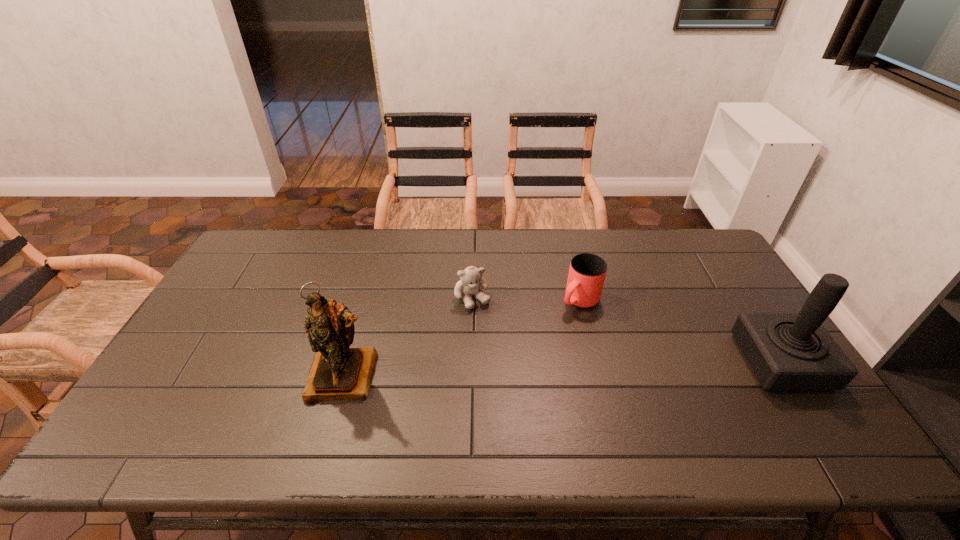
Where is `figurine`? Image resolution: width=960 pixels, height=540 pixels. figurine is located at coordinates (338, 372).

Image resolution: width=960 pixels, height=540 pixels. I want to click on joystick, so click(x=786, y=350).

The height and width of the screenshot is (540, 960). I want to click on the second object from right to left, so click(x=587, y=272).

The width and height of the screenshot is (960, 540). I want to click on teddy bear, so click(471, 277).

Image resolution: width=960 pixels, height=540 pixels. In order to click on vacant space located on the handle side of the cup in this screenshot , I will do `click(546, 332)`.

Identify the location of vacant region located 0.250m on the handle side of the cup. (515, 360).

At what (x,y) coordinates should I click in order to perform the action: click on vacant area situated 0.370m on the handle side of the cup. Please return your answer as a coordinate pair (x, y). The height and width of the screenshot is (540, 960). Looking at the image, I should click on (485, 387).

Find the location of `free location located 0.150m on the face of the third object from right to left`. free location located 0.150m on the face of the third object from right to left is located at coordinates pyautogui.click(x=498, y=348).

Locate an element on the screen. vacant space located on the face of the third object from right to left is located at coordinates (525, 397).

Where is `vacant space situated 0.070m on the face of the third object from right to left`? Image resolution: width=960 pixels, height=540 pixels. vacant space situated 0.070m on the face of the third object from right to left is located at coordinates (488, 328).